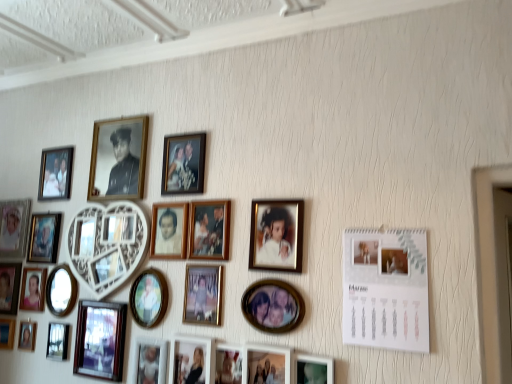
Measure the distance between white wood heart-shaped frame at upper left, the 11th picture frame from the left, and camera.

A distance of 5.08 feet exists between white wood heart-shaped frame at upper left, the 11th picture frame from the left, and camera.

What do you see at coordinates (100, 339) in the screenshot? Image resolution: width=512 pixels, height=384 pixels. I see `matte black picture frame at lower left, arranged as the 16th picture frame when viewed from the right` at bounding box center [100, 339].

What do you see at coordinates (57, 341) in the screenshot? I see `metallic silver photo frame at lower left, the ninth picture frame positioned from the left` at bounding box center [57, 341].

Find the location of a particular element. matte black picture frame at upper left, which appears as the nineteenth picture frame when viewed from the right is located at coordinates (55, 173).

At what (x,y) coordinates should I click in order to perform the action: click on matte gold picture frame at center, which is the 23th picture frame from left to right. Please return your answer as a coordinate pair (x, y). The width and height of the screenshot is (512, 384). Looking at the image, I should click on (276, 235).

Does point (9, 225) come in front of point (40, 300)?

No, (9, 225) is further to viewer.

Is matte silver photo frame at upper left, the 23th picture frame when ordered from right to left, next to matte wooden photo frame at lower left, the 21th picture frame viewed from the right?

No, matte silver photo frame at upper left, the 23th picture frame when ordered from right to left, is not in contact with matte wooden photo frame at lower left, the 21th picture frame viewed from the right.

How far apart are matte silver photo frame at upper left, which ranks as the 3th picture frame in left-to-right order, and matte wooden photo frame at lower left, the 5th picture frame viewed from the left?

7.70 inches.

From a real-world perspective, does matte silver photo frame at upper left, which ranks as the 3th picture frame in left-to-right order, sit lower than matte wooden photo frame at lower left, the 5th picture frame viewed from the left?

No.

Is wooden photo frame at lower left, placed as the first picture frame when sorted from left to right, oriented away from matte black photo frame at lower right, the 24th picture frame positioned from the left?

No.

Does wooden photo frame at lower left, placed as the first picture frame when sorted from left to right, have a larger size compared to matte black photo frame at lower right, the 24th picture frame positioned from the left?

Yes.

From a real-world perspective, is wooden photo frame at lower left, the 25th picture frame in the right-to-left sequence, beneath matte black photo frame at lower right, which appears as the 2th picture frame when viewed from the right?

No, from a real-world perspective, wooden photo frame at lower left, the 25th picture frame in the right-to-left sequence, is not under matte black photo frame at lower right, which appears as the 2th picture frame when viewed from the right.

Does wooden photo frame at lower left, placed as the first picture frame when sorted from left to right, have a greater width compared to matte black photo frame at lower right, which appears as the 2th picture frame when viewed from the right?

Yes, wooden photo frame at lower left, placed as the first picture frame when sorted from left to right, is wider than matte black photo frame at lower right, which appears as the 2th picture frame when viewed from the right.

Which of these two, gold metallic photo frame at center, placed as the 4th picture frame when sorted from right to left, or metallic gold picture frame at upper left, the 14th picture frame when ordered from right to left, is wider?

Wider between the two is gold metallic photo frame at center, placed as the 4th picture frame when sorted from right to left.

From a real-world perspective, is gold metallic photo frame at center, which is counted as the 22th picture frame, starting from the left, physically below metallic gold picture frame at upper left, the 14th picture frame when ordered from right to left?

Correct, in the physical world, gold metallic photo frame at center, which is counted as the 22th picture frame, starting from the left, is lower than metallic gold picture frame at upper left, the 14th picture frame when ordered from right to left.

From the metallic gold picture frame at upper left, the 14th picture frame when ordered from right to left, count 10th picture frame to the right and point to it. Please provide its 2D coordinates.

[(273, 306)]

Considering the sizes of matte gold picture frame at center, which appears as the thirteenth picture frame when viewed from the left, and matte black picture frame at center, placed as the 9th picture frame when sorted from right to left, in the image, is matte gold picture frame at center, which appears as the thirteenth picture frame when viewed from the left, taller or shorter than matte black picture frame at center, placed as the 9th picture frame when sorted from right to left,?

In the image, matte gold picture frame at center, which appears as the thirteenth picture frame when viewed from the left, appears to be taller than matte black picture frame at center, placed as the 9th picture frame when sorted from right to left.

Is the depth of matte gold picture frame at center, arranged as the 13th picture frame when viewed from the right, less than that of matte black picture frame at center, placed as the 9th picture frame when sorted from right to left?

That is False.

From the image's perspective, would you say matte gold picture frame at center, arranged as the 13th picture frame when viewed from the right, is positioned over matte black picture frame at center, placed as the 9th picture frame when sorted from right to left?

Correct, matte gold picture frame at center, arranged as the 13th picture frame when viewed from the right, appears higher than matte black picture frame at center, placed as the 9th picture frame when sorted from right to left, in the image.

Based on the photo, considering the relative sizes of matte gold picture frame at center, which appears as the thirteenth picture frame when viewed from the left, and matte black picture frame at center, the 17th picture frame from the left, in the image provided, is matte gold picture frame at center, which appears as the thirteenth picture frame when viewed from the left, smaller than matte black picture frame at center, the 17th picture frame from the left,?

Yes, matte gold picture frame at center, which appears as the thirteenth picture frame when viewed from the left, is smaller than matte black picture frame at center, the 17th picture frame from the left.

From the image's perspective, is white wood heart-shaped frame at upper left, which is counted as the 15th picture frame, starting from the right, below matte gold picture frame at center, the 3th picture frame from the right?

Yes, from the image's perspective, white wood heart-shaped frame at upper left, which is counted as the 15th picture frame, starting from the right, is below matte gold picture frame at center, the 3th picture frame from the right.

Between white wood heart-shaped frame at upper left, which is counted as the 15th picture frame, starting from the right, and matte gold picture frame at center, which is the 23th picture frame from left to right, which one has less height?

With less height is matte gold picture frame at center, which is the 23th picture frame from left to right.

Considering the relative sizes of white wood heart-shaped frame at upper left, the 11th picture frame from the left, and matte gold picture frame at center, the 3th picture frame from the right, in the image provided, is white wood heart-shaped frame at upper left, the 11th picture frame from the left, smaller than matte gold picture frame at center, the 3th picture frame from the right,?

Actually, white wood heart-shaped frame at upper left, the 11th picture frame from the left, might be larger than matte gold picture frame at center, the 3th picture frame from the right.

Is matte black picture frame at upper left, acting as the 7th picture frame starting from the left, oriented away from white paper calendar at upper right, which is the 25th picture frame from left to right?

matte black picture frame at upper left, acting as the 7th picture frame starting from the left, is not turned away from white paper calendar at upper right, which is the 25th picture frame from left to right.

How far apart are matte black picture frame at upper left, acting as the 7th picture frame starting from the left, and white paper calendar at upper right, the first picture frame when ordered from right to left?

The distance of matte black picture frame at upper left, acting as the 7th picture frame starting from the left, from white paper calendar at upper right, the first picture frame when ordered from right to left, is 4.28 feet.

Would you say white paper calendar at upper right, which is the 25th picture frame from left to right, is part of matte black picture frame at upper left, acting as the 7th picture frame starting from the left,'s contents?

Actually, white paper calendar at upper right, which is the 25th picture frame from left to right, is outside matte black picture frame at upper left, acting as the 7th picture frame starting from the left.

Considering the sizes of matte black picture frame at upper left, which appears as the nineteenth picture frame when viewed from the right, and white paper calendar at upper right, the first picture frame when ordered from right to left, in the image, is matte black picture frame at upper left, which appears as the nineteenth picture frame when viewed from the right, wider or thinner than white paper calendar at upper right, the first picture frame when ordered from right to left,?

Considering their sizes, matte black picture frame at upper left, which appears as the nineteenth picture frame when viewed from the right, looks broader than white paper calendar at upper right, the first picture frame when ordered from right to left.

Can you confirm if matte black frame at lower center, the 12th picture frame in the right-to-left sequence, is smaller than matte wooden photo frame at lower left, the 5th picture frame viewed from the left?

Incorrect, matte black frame at lower center, the 12th picture frame in the right-to-left sequence, is not smaller in size than matte wooden photo frame at lower left, the 5th picture frame viewed from the left.

Does matte black frame at lower center, the fourteenth picture frame when ordered from left to right, appear on the right side of matte wooden photo frame at lower left, the 21th picture frame viewed from the right?

Indeed, matte black frame at lower center, the fourteenth picture frame when ordered from left to right, is positioned on the right side of matte wooden photo frame at lower left, the 21th picture frame viewed from the right.

Is matte black frame at lower center, the 12th picture frame in the right-to-left sequence, directly adjacent to matte wooden photo frame at lower left, the 5th picture frame viewed from the left?

No, matte black frame at lower center, the 12th picture frame in the right-to-left sequence, is not touching matte wooden photo frame at lower left, the 5th picture frame viewed from the left.

From a real-world perspective, is matte black frame at lower center, the 12th picture frame in the right-to-left sequence, physically located above or below matte wooden photo frame at lower left, the 21th picture frame viewed from the right?

Clearly, from a real-world perspective, matte black frame at lower center, the 12th picture frame in the right-to-left sequence, is below matte wooden photo frame at lower left, the 21th picture frame viewed from the right.

Starting from the matte silver photo frame at upper left, which ranks as the 3th picture frame in left-to-right order, which picture frame is the 2nd one to the right? Please provide its 2D coordinates.

[(33, 289)]

The width and height of the screenshot is (512, 384). In order to click on the 7th picture frame above the wooden photo frame at lower left, the 25th picture frame in the right-to-left sequence (from the image's perspective) in this screenshot , I will do `click(314, 370)`.

Looking at the image, which one is located further to matte wooden photo frame at lower center, marked as the 21th picture frame in a left-to-right arrangement, matte black photo frame at lower left, the 4th picture frame from the left, or matte wooden photo frame at lower center, placed as the sixth picture frame when sorted from right to left?

The object further to matte wooden photo frame at lower center, marked as the 21th picture frame in a left-to-right arrangement, is matte black photo frame at lower left, the 4th picture frame from the left.

From the image, which object appears to be nearer to matte gold picture frame at center, the 3th picture frame from the right, matte silver photo frame at upper left, which ranks as the 3th picture frame in left-to-right order, or matte black frame at lower center, the 12th picture frame in the right-to-left sequence?

matte black frame at lower center, the 12th picture frame in the right-to-left sequence, is positioned closer to the anchor matte gold picture frame at center, the 3th picture frame from the right.

In the scene shown: Looking at the image, which one is located closer to matte black picture frame at center, the 17th picture frame from the left, metallic silver photo frame at lower left, the ninth picture frame positioned from the left, or matte gold picture frame at center, which is the 23th picture frame from left to right?

The object closer to matte black picture frame at center, the 17th picture frame from the left, is matte gold picture frame at center, which is the 23th picture frame from left to right.

Estimate the real-world distances between objects in this image. Which object is further from matte black frame at lower center, the 12th picture frame in the right-to-left sequence, metallic gold photo frame at center, which ranks as the eighth picture frame in right-to-left order, or matte black picture frame at lower left, arranged as the 16th picture frame when viewed from the right?

metallic gold photo frame at center, which ranks as the eighth picture frame in right-to-left order, is positioned further to the anchor matte black frame at lower center, the 12th picture frame in the right-to-left sequence.

Based on the photo, which object lies nearer to the anchor point matte black picture frame at lower left, arranged as the 16th picture frame when viewed from the right, matte gold picture frame at center, which appears as the thirteenth picture frame when viewed from the left, or wooden photo frame at lower left, placed as the first picture frame when sorted from left to right?

Based on the image, matte gold picture frame at center, which appears as the thirteenth picture frame when viewed from the left, appears to be nearer to matte black picture frame at lower left, arranged as the 16th picture frame when viewed from the right.

Based on the photo, based on their spatial positions, is matte wooden photo frame at lower left, the 21th picture frame viewed from the right, or matte black frame at lower center, the fourteenth picture frame when ordered from left to right, closer to metallic gold picture frame at upper left, the 12th picture frame viewed from the left?

Based on the image, matte wooden photo frame at lower left, the 21th picture frame viewed from the right, appears to be nearer to metallic gold picture frame at upper left, the 12th picture frame viewed from the left.

Considering their positions, is metallic silver photo frame at lower left, the ninth picture frame positioned from the left, positioned closer to white wood heart-shaped frame at upper left, the 11th picture frame from the left, than matte gold picture frame at center, arranged as the 13th picture frame when viewed from the right?

Based on the image, matte gold picture frame at center, arranged as the 13th picture frame when viewed from the right, appears to be nearer to white wood heart-shaped frame at upper left, the 11th picture frame from the left.

From the image, which object appears to be farther from white paper calendar at upper right, the first picture frame when ordered from right to left, matte black photo frame at lower left, the 4th picture frame from the left, or metallic silver photo frame at lower left, the seventeenth picture frame viewed from the right?

Based on the image, matte black photo frame at lower left, the 4th picture frame from the left, appears to be further to white paper calendar at upper right, the first picture frame when ordered from right to left.

Find the location of a particular element. picture frame between wooden circular frame at lower left, positioned as the eighth picture frame in left-to-right order, and matte black picture frame at lower left, arranged as the 16th picture frame when viewed from the right, from left to right is located at coordinates (57, 341).